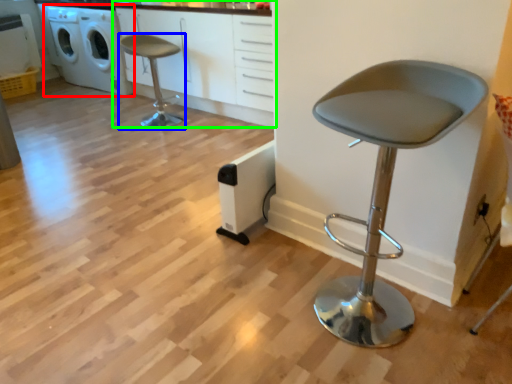
Question: Considering the real-world distances, which object is farthest from washing machine (highlighted by a red box)? chair (highlighted by a blue box) or cabinetry (highlighted by a green box)?

Choices:
 (A) chair
 (B) cabinetry

Answer: (A)